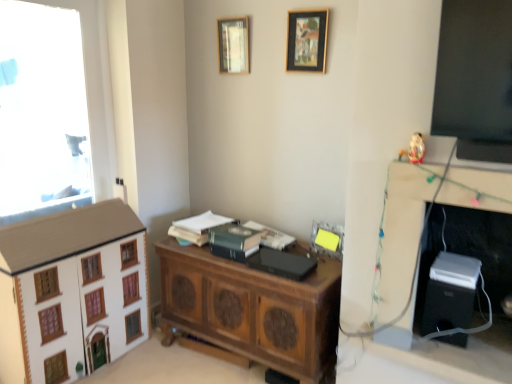
Question: Considering the positions of wooden picture frame at upper center, acting as the 2th picture frame starting from the bottom, and wooden chest at center in the image, is wooden picture frame at upper center, acting as the 2th picture frame starting from the bottom, taller or shorter than wooden chest at center?

Choices:
 (A) tall
 (B) short

Answer: (B)

Question: In terms of width, does wooden picture frame at upper center, placed as the 2th picture frame when sorted from top to bottom, look wider or thinner when compared to wooden chest at center?

Choices:
 (A) wide
 (B) thin

Answer: (B)

Question: Estimate the real-world distances between objects in this image. Which object is closer to the white wood dresser at lower left?

Choices:
 (A) black matte book at center, acting as the first book starting from the right
 (B) green matte book at center, the 3th book in the left-to-right sequence
 (C) porcelain white figurine at upper right
 (D) matte glass picture frame at upper center, which appears as the third picture frame when ordered from the bottom
 (E) green matte book at center, which is counted as the third book, starting from the right

Answer: (E)

Question: Which object is positioned closest to the black plastic speaker at lower right?

Choices:
 (A) matte plastic picture frame at center, which is counted as the 3th picture frame, starting from the left
 (B) porcelain white figurine at upper right
 (C) white wood dresser at lower left
 (D) green matte book at center, which is the 2th book in left-to-right order
 (E) black plastic computer desk at right

Answer: (E)